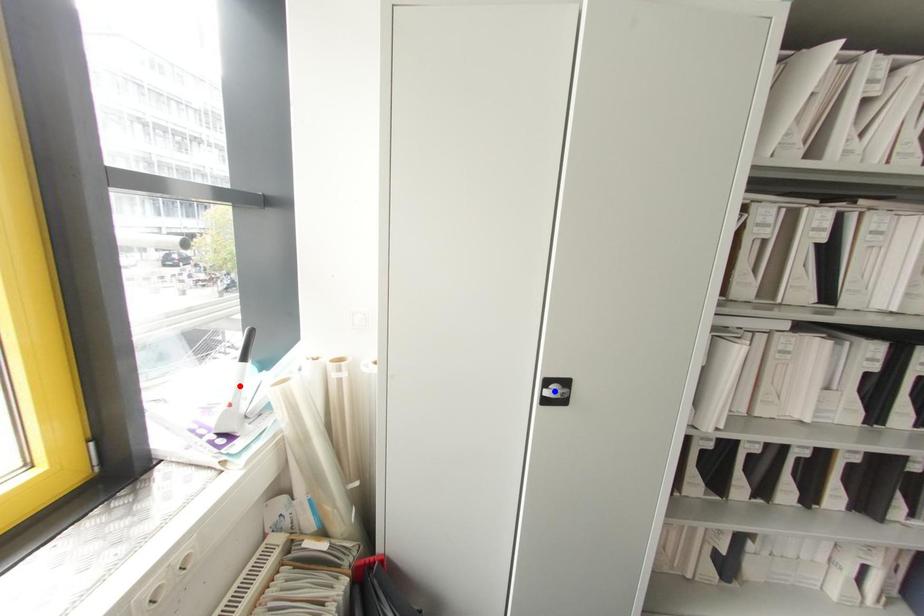
Question: Two points are marked on the image. Which point is closer to the camera?

Choices:
 (A) Blue point is closer.
 (B) Red point is closer.

Answer: (A)